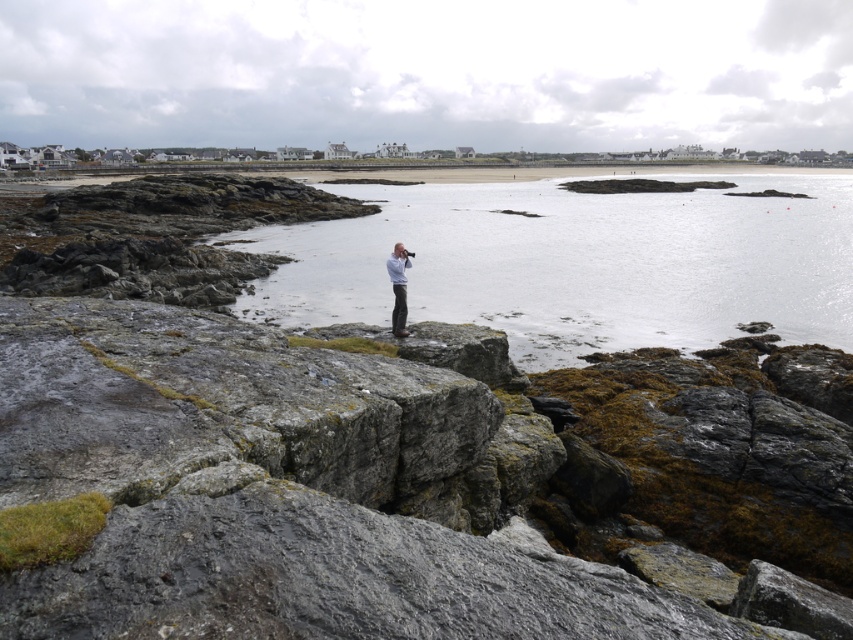
Question: Can you confirm if clear water at center is positioned below white matte shirt at center?

Choices:
 (A) no
 (B) yes

Answer: (A)

Question: Is clear water at center closer to the viewer compared to white matte shirt at center?

Choices:
 (A) no
 (B) yes

Answer: (A)

Question: Which point is closer to the camera taking this photo?

Choices:
 (A) (x=22, y=348)
 (B) (x=337, y=300)

Answer: (A)

Question: Which object is positioned farthest from the white matte shirt at center?

Choices:
 (A) gray rock at center
 (B) clear water at center

Answer: (B)

Question: Estimate the real-world distances between objects in this image. Which object is closer to the gray rock at center?

Choices:
 (A) clear water at center
 (B) white matte shirt at center

Answer: (B)

Question: In this image, where is gray rock at center located relative to clear water at center?

Choices:
 (A) right
 (B) left

Answer: (B)